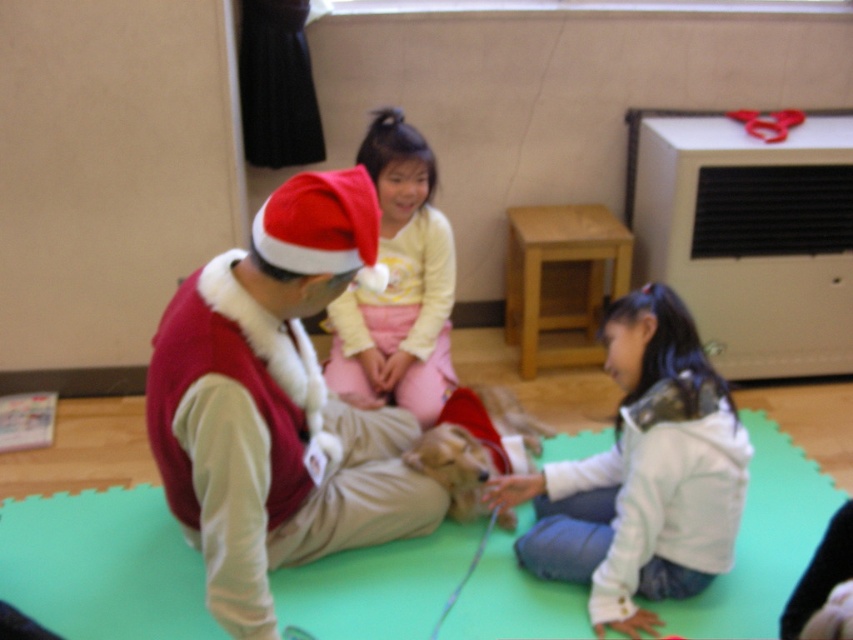
Question: Can you confirm if fuzzy red vest at center is positioned below white fleece jacket at lower right?

Choices:
 (A) yes
 (B) no

Answer: (B)

Question: Which point appears farthest from the camera in this image?

Choices:
 (A) (397, 349)
 (B) (550, 508)
 (C) (262, 323)

Answer: (A)

Question: Which of the following is the farthest from the observer?

Choices:
 (A) light yellow fleece shirt at center
 (B) white fleece jacket at lower right
 (C) fuzzy red vest at center

Answer: (A)

Question: Which is nearer to the white fleece jacket at lower right?

Choices:
 (A) light yellow fleece shirt at center
 (B) fuzzy red vest at center

Answer: (B)

Question: Does white fleece jacket at lower right appear on the left side of light yellow fleece shirt at center?

Choices:
 (A) yes
 (B) no

Answer: (B)

Question: Is fuzzy red vest at center bigger than white fleece jacket at lower right?

Choices:
 (A) yes
 (B) no

Answer: (A)